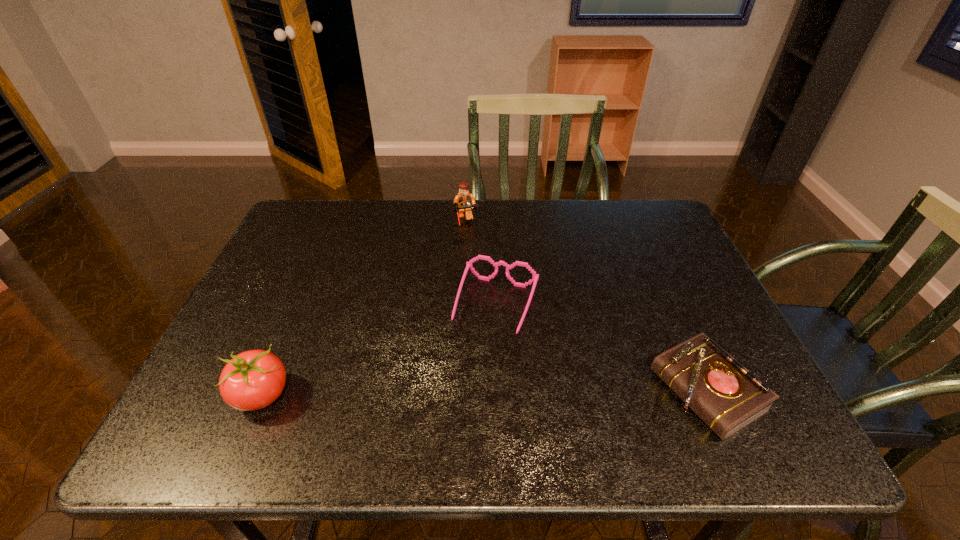
The height and width of the screenshot is (540, 960). Find the location of `vacant space at the far edge of the desktop`. vacant space at the far edge of the desktop is located at coordinates coord(393,218).

Image resolution: width=960 pixels, height=540 pixels. In the image, there is a desktop. Identify the location of free space at the near edge. (289, 402).

The height and width of the screenshot is (540, 960). Find the location of `blank space at the left edge of the desktop`. blank space at the left edge of the desktop is located at coordinates (276, 275).

I want to click on vacant space at the right edge of the desktop, so click(649, 247).

Identify the location of vacant area at the far left corner of the desktop. (339, 217).

Where is `free spot between the spectacles and the Lego`? free spot between the spectacles and the Lego is located at coordinates (479, 265).

What are the coordinates of `vacant space in between the farthest object and the shortest object` in the screenshot? It's located at (585, 307).

Identify the location of vacant area between the tomato and the spectacles. The image size is (960, 540). (380, 350).

Locate an element on the screen. This screenshot has height=540, width=960. free space between the Lego and the leftmost object is located at coordinates (363, 309).

You are a GUI agent. You are given a task and a screenshot of the screen. Output one action in this format:
    pyautogui.click(x=<x>, y=<y>)
    Task: Click on the free spot between the farthest object and the second farthest object
    The width and height of the screenshot is (960, 540).
    Given the screenshot: What is the action you would take?
    [x=479, y=265]